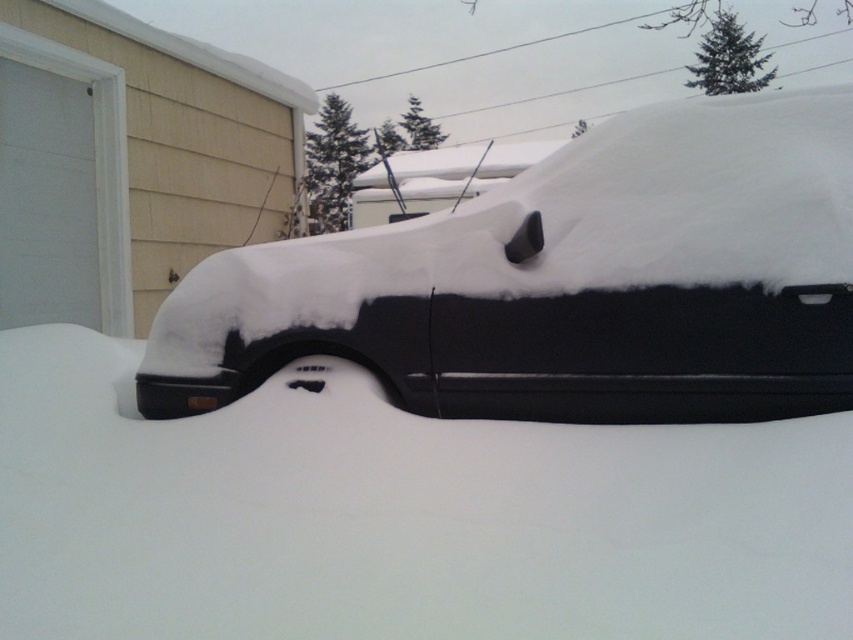
You are a delivery person trying to reach the beige house with a white garage door. You see the white fluffy snow at center and the black matte van at center blocking the path. Can you drive your delivery truck through the area between them?

The white fluffy snow at center has a lesser height compared to black matte van at center, so the van is taller than the snow. Since the delivery truck is taller than the snow, it might still hit the van if it tries to pass through. Therefore, it is not safe to drive through that area.

You are a delivery driver who needs to reach the beige house with a white garage door. Your vehicle is a black matte van at center. There is white fluffy snow at center blocking your path. Can you drive through the snow to reach the house?

The white fluffy snow at center is positioned under the black matte van at center, so the snow is underneath the van and not blocking the path. Therefore, the driver can drive through to reach the beige house with a white garage door.

You are standing at the point marked by the coordinates point [398,515], which is at the center of the snowy scene. Looking around, you see the white fluffy snow at center and the black car partially buried under snow. Which direction should you move to reach the black car?

The point [398,515] marks the white fluffy snow at center. To reach the black car, you should move towards the lower part of the image since the car is positioned at the lower area compared to the central snow location.